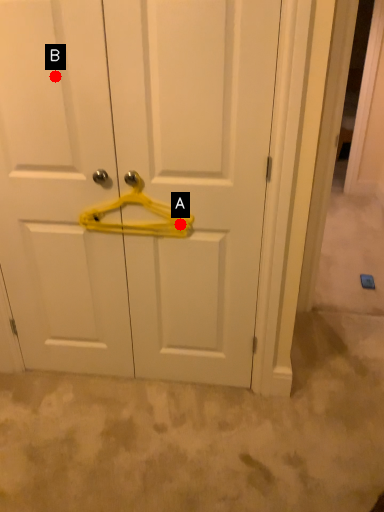
Question: Two points are circled on the image, labeled by A and B beside each circle. Which point is further to the camera?

Choices:
 (A) A is further
 (B) B is further

Answer: (A)